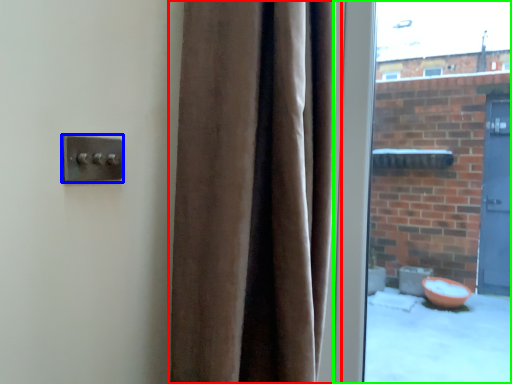
Question: Which object is the closest to the curtain (highlighted by a red box)? Choose among these: door handle (highlighted by a blue box) or window (highlighted by a green box).

Choices:
 (A) door handle
 (B) window

Answer: (A)